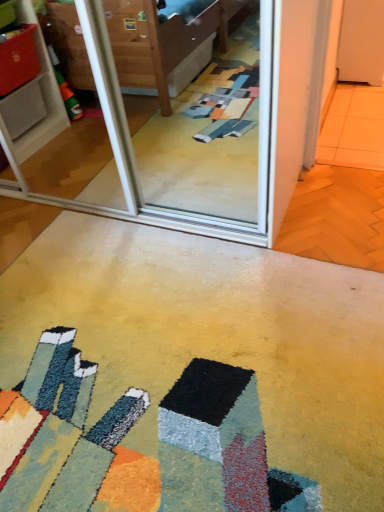
Where is `transparent glass screen door at upper center`? Image resolution: width=384 pixels, height=512 pixels. transparent glass screen door at upper center is located at coordinates (161, 121).

What is the approximate width of transparent glass screen door at upper center?

transparent glass screen door at upper center is 19.34 inches wide.

What do you see at coordinates (161, 121) in the screenshot?
I see `transparent glass screen door at upper center` at bounding box center [161, 121].

Measure the distance between point (99, 362) and camera.

1.37 meters.

Where is `carpeted floor at center`? The width and height of the screenshot is (384, 512). carpeted floor at center is located at coordinates (187, 375).

Image resolution: width=384 pixels, height=512 pixels. What do you see at coordinates (187, 375) in the screenshot? I see `carpeted floor at center` at bounding box center [187, 375].

Find the location of a particular element. The image size is (384, 512). transparent glass screen door at upper center is located at coordinates (161, 121).

Based on their positions, is transparent glass screen door at upper center located to the left or right of carpeted floor at center?

Based on their positions, transparent glass screen door at upper center is located to the left of carpeted floor at center.

In the image, is transparent glass screen door at upper center positioned in front of or behind carpeted floor at center?

Clearly, transparent glass screen door at upper center is behind carpeted floor at center.

Does point (123, 58) appear closer or farther from the camera than point (260, 447)?

Point (123, 58) is farther from the camera than point (260, 447).

From the image's perspective, who appears lower, transparent glass screen door at upper center or carpeted floor at center?

carpeted floor at center.

From a real-world perspective, is transparent glass screen door at upper center under carpeted floor at center?

No, from a real-world perspective, transparent glass screen door at upper center is not beneath carpeted floor at center.

Can you confirm if transparent glass screen door at upper center is thinner than carpeted floor at center?

Correct, the width of transparent glass screen door at upper center is less than that of carpeted floor at center.

Who is taller, transparent glass screen door at upper center or carpeted floor at center?

With more height is transparent glass screen door at upper center.

Looking at the image, does transparent glass screen door at upper center seem bigger or smaller compared to carpeted floor at center?

Considering their sizes, transparent glass screen door at upper center takes up more space than carpeted floor at center.

Is transparent glass screen door at upper center inside the boundaries of carpeted floor at center, or outside?

transparent glass screen door at upper center is not inside carpeted floor at center, it's outside.

Is transparent glass screen door at upper center not near carpeted floor at center?

No, transparent glass screen door at upper center is not far from carpeted floor at center.

Is carpeted floor at center at the back of transparent glass screen door at upper center?

No, carpeted floor at center is not at the back of transparent glass screen door at upper center.

How different are the orientations of transparent glass screen door at upper center and carpeted floor at center in degrees?

There is a 180-degree angle between the facing directions of transparent glass screen door at upper center and carpeted floor at center.

Looking at this image, measure the distance between transparent glass screen door at upper center and carpeted floor at center.

transparent glass screen door at upper center is 35.88 inches away from carpeted floor at center.

Where is `screen door above the carpeted floor at center (from the image's perspective)`? The width and height of the screenshot is (384, 512). screen door above the carpeted floor at center (from the image's perspective) is located at coordinates (161, 121).

In the image, is carpeted floor at center on the left side or the right side of transparent glass screen door at upper center?

From the image, it's evident that carpeted floor at center is to the right of transparent glass screen door at upper center.

Is carpeted floor at center closer to camera compared to transparent glass screen door at upper center?

Yes, carpeted floor at center is closer to the camera.

Is point (9, 487) closer or farther from the camera than point (131, 209)?

Point (9, 487) is closer to the camera than point (131, 209).

From the image's perspective, is carpeted floor at center beneath transparent glass screen door at upper center?

Yes.

From a real-world perspective, between carpeted floor at center and transparent glass screen door at upper center, who is vertically lower?

carpeted floor at center.

Does carpeted floor at center have a greater width compared to transparent glass screen door at upper center?

Yes, carpeted floor at center is wider than transparent glass screen door at upper center.

Considering the relative sizes of carpeted floor at center and transparent glass screen door at upper center in the image provided, is carpeted floor at center shorter than transparent glass screen door at upper center?

Indeed, carpeted floor at center has a lesser height compared to transparent glass screen door at upper center.

Who is smaller, carpeted floor at center or transparent glass screen door at upper center?

carpeted floor at center is smaller.

Do you think carpeted floor at center is within transparent glass screen door at upper center, or outside of it?

carpeted floor at center is outside transparent glass screen door at upper center.

Is carpeted floor at center far from transparent glass screen door at upper center?

No, carpeted floor at center is not far away from transparent glass screen door at upper center.

Is transparent glass screen door at upper center at the back of carpeted floor at center?

carpeted floor at center does not have its back to transparent glass screen door at upper center.

Where is `concrete on the right of transparent glass screen door at upper center`? concrete on the right of transparent glass screen door at upper center is located at coordinates (187, 375).

This screenshot has height=512, width=384. In order to click on screen door located behind the carpeted floor at center in this screenshot , I will do `click(161, 121)`.

The width and height of the screenshot is (384, 512). In order to click on concrete on the right of transparent glass screen door at upper center in this screenshot , I will do `click(187, 375)`.